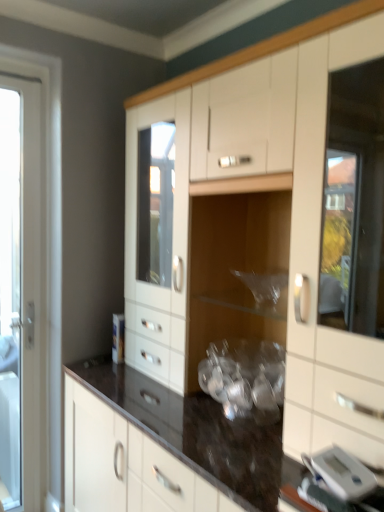
Question: Is white glossy door at left facing towards silver metallic digital clock at lower right?

Choices:
 (A) no
 (B) yes

Answer: (A)

Question: Would you say white glossy door at left is outside silver metallic digital clock at lower right?

Choices:
 (A) no
 (B) yes

Answer: (B)

Question: Is white glossy door at left with silver metallic digital clock at lower right?

Choices:
 (A) no
 (B) yes

Answer: (A)

Question: Is white glossy door at left taller than silver metallic digital clock at lower right?

Choices:
 (A) no
 (B) yes

Answer: (B)

Question: Does white glossy door at left have a lesser height compared to silver metallic digital clock at lower right?

Choices:
 (A) no
 (B) yes

Answer: (A)

Question: From a real-world perspective, is white glossy cabinet at center positioned above or below silver metallic digital clock at lower right?

Choices:
 (A) above
 (B) below

Answer: (A)

Question: In the image, is white glossy cabinet at center positioned in front of or behind silver metallic digital clock at lower right?

Choices:
 (A) behind
 (B) front

Answer: (B)

Question: In the image, is white glossy cabinet at center on the left side or the right side of silver metallic digital clock at lower right?

Choices:
 (A) left
 (B) right

Answer: (A)

Question: Is white glossy cabinet at center spatially inside silver metallic digital clock at lower right, or outside of it?

Choices:
 (A) inside
 (B) outside

Answer: (B)

Question: From a real-world perspective, is white glossy door at left physically located above or below silver metallic digital clock at lower right?

Choices:
 (A) above
 (B) below

Answer: (A)

Question: Is white glossy door at left wider or thinner than silver metallic digital clock at lower right?

Choices:
 (A) wide
 (B) thin

Answer: (B)

Question: In the image, is white glossy door at left positioned in front of or behind silver metallic digital clock at lower right?

Choices:
 (A) behind
 (B) front

Answer: (A)

Question: Looking at the image, does white glossy door at left seem bigger or smaller compared to silver metallic digital clock at lower right?

Choices:
 (A) big
 (B) small

Answer: (A)

Question: Relative to white glossy door at left, is silver metallic digital clock at lower right in front or behind?

Choices:
 (A) front
 (B) behind

Answer: (A)

Question: From a real-world perspective, is silver metallic digital clock at lower right physically located above or below white glossy door at left?

Choices:
 (A) below
 (B) above

Answer: (A)